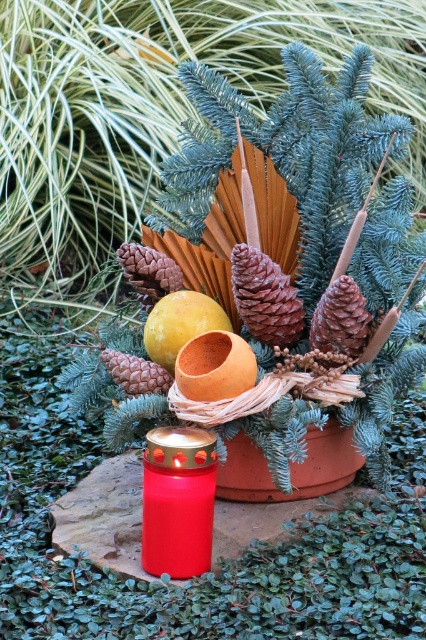
Image resolution: width=426 pixels, height=640 pixels. Describe the element at coordinates (215, 365) in the screenshot. I see `orange matte bowl at center` at that location.

Does point (178, 385) come behind point (176, 291)?

No, it is not.

Where is `orange matte bowl at center`? This screenshot has width=426, height=640. orange matte bowl at center is located at coordinates point(215,365).

Who is more distant from viewer, [181,317] or [104,365]?

The point [104,365] is behind.

Is yellow matte/orange fruit at center smaller than brown matte pine cone at center-left?

Actually, yellow matte/orange fruit at center might be larger than brown matte pine cone at center-left.

Image resolution: width=426 pixels, height=640 pixels. In order to click on yellow matte/orange fruit at center in this screenshot , I will do `click(180, 324)`.

Find the location of a particular element. yellow matte/orange fruit at center is located at coordinates (180, 324).

Can you confirm if orange matte bowl at center is smaller than brown matte pine cone at center-left?

No.

Can you confirm if orange matte bowl at center is positioned above brown matte pine cone at center-left?

Indeed, orange matte bowl at center is positioned over brown matte pine cone at center-left.

Which is behind, point (252, 356) or point (138, 385)?

Point (138, 385)

You are a GUI agent. You are given a task and a screenshot of the screen. Output one action in this format:
    pyautogui.click(x=<x>, y=<y>)
    Task: Click on the orange matte bowl at center
    The image size is (426, 640).
    Given the screenshot: What is the action you would take?
    pyautogui.click(x=215, y=365)